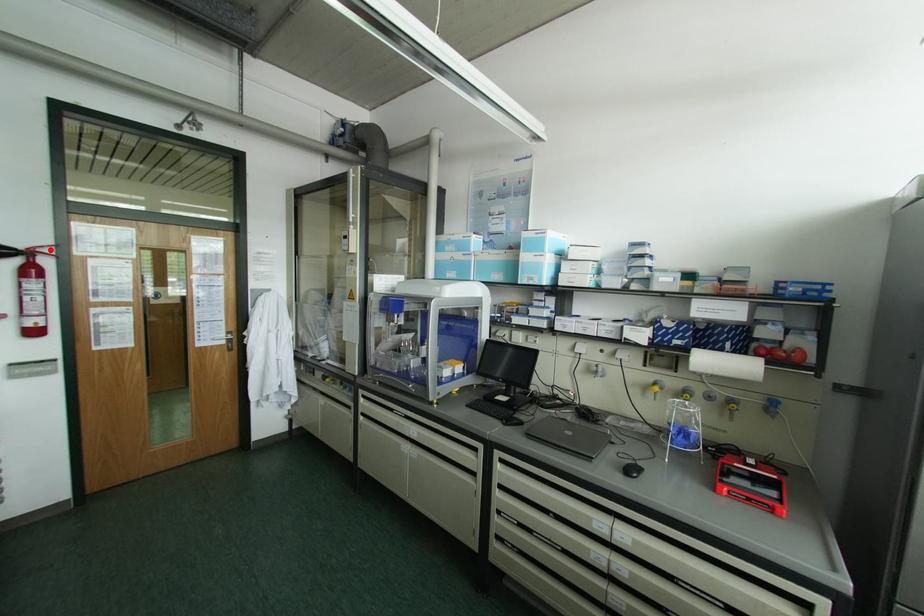
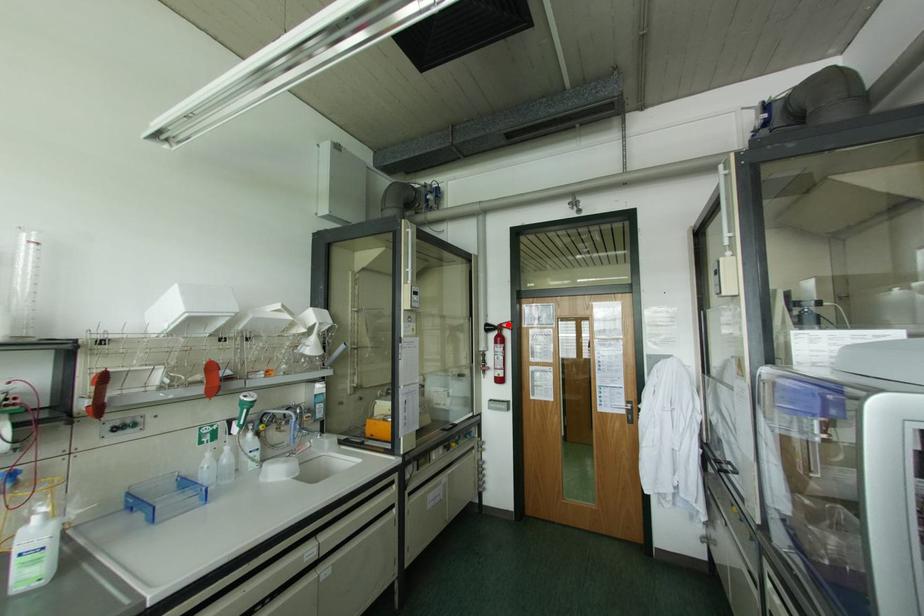
I am providing you with two images of the same scene from different viewpoints. A red point is marked on the first image and another point is marked on the second image. Are the points marked in image1 and image2 representing the same 3D position?

Yes